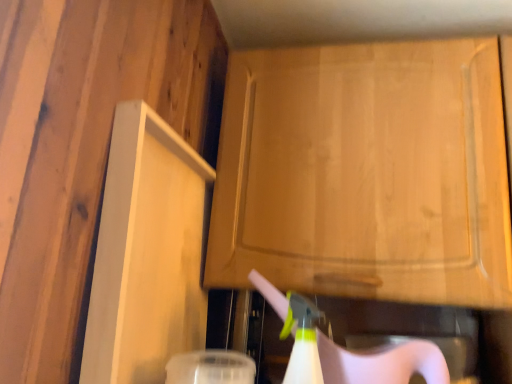
The height and width of the screenshot is (384, 512). What do you see at coordinates (146, 253) in the screenshot?
I see `white matte cabinet at left` at bounding box center [146, 253].

Identify the location of white matte cabinet at left. (146, 253).

At what (x,y) coordinates should I click in order to perform the action: click on white matte cabinet at left. Please return your answer as a coordinate pair (x, y). The width and height of the screenshot is (512, 384). Looking at the image, I should click on (146, 253).